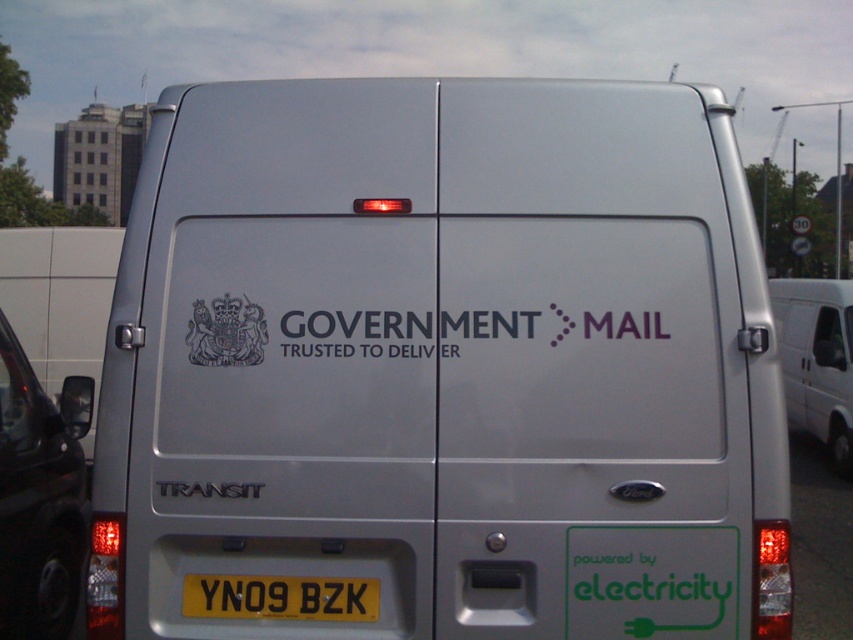
Question: Which object is the closest to the white matte van at right?

Choices:
 (A) black glossy car at left
 (B) silver metallic van at center

Answer: (A)

Question: Can you confirm if silver metallic van at center is positioned to the left of black glossy car at left?

Choices:
 (A) yes
 (B) no

Answer: (B)

Question: Which point is farther to the camera?

Choices:
 (A) white matte government mail logo at center
 (B) yellow metallic license plate at center

Answer: (A)

Question: Observing the image, what is the correct spatial positioning of black glossy car at left in reference to white matte government mail logo at center?

Choices:
 (A) right
 (B) left

Answer: (B)

Question: Can you confirm if black glossy car at left is bigger than white matte van at right?

Choices:
 (A) no
 (B) yes

Answer: (B)

Question: Which point is closer to the camera taking this photo?

Choices:
 (A) (610, 323)
 (B) (814, 307)
 (C) (347, 522)
 (D) (73, 404)

Answer: (C)